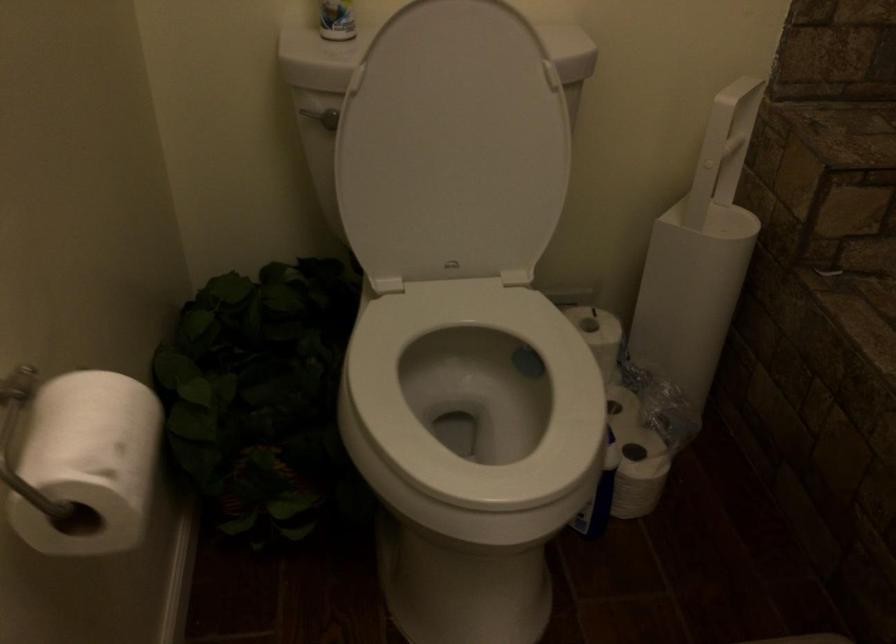
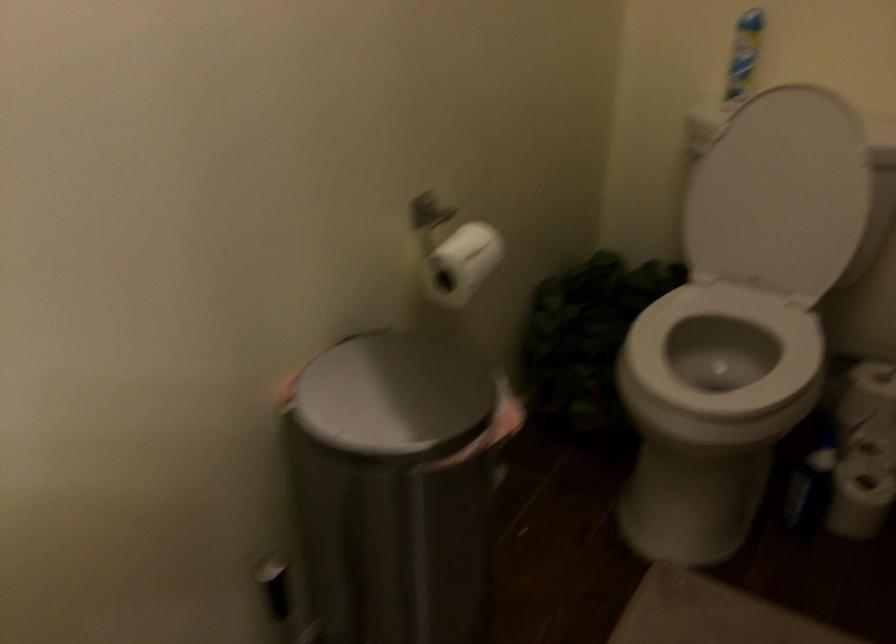
Question: The camera is either moving clockwise (left) or counter-clockwise (right) around the object. The first image is from the beginning of the video and the second image is from the end. Is the camera moving left or right when shooting the video?

Choices:
 (A) Left
 (B) Right

Answer: (B)